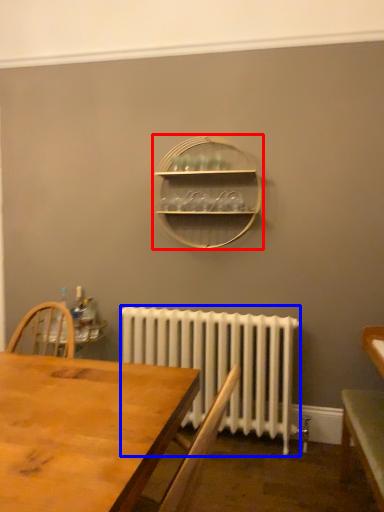
Question: Which object appears closest to the camera in this image, shelf (highlighted by a red box) or radiator (highlighted by a blue box)?

Choices:
 (A) shelf
 (B) radiator

Answer: (B)